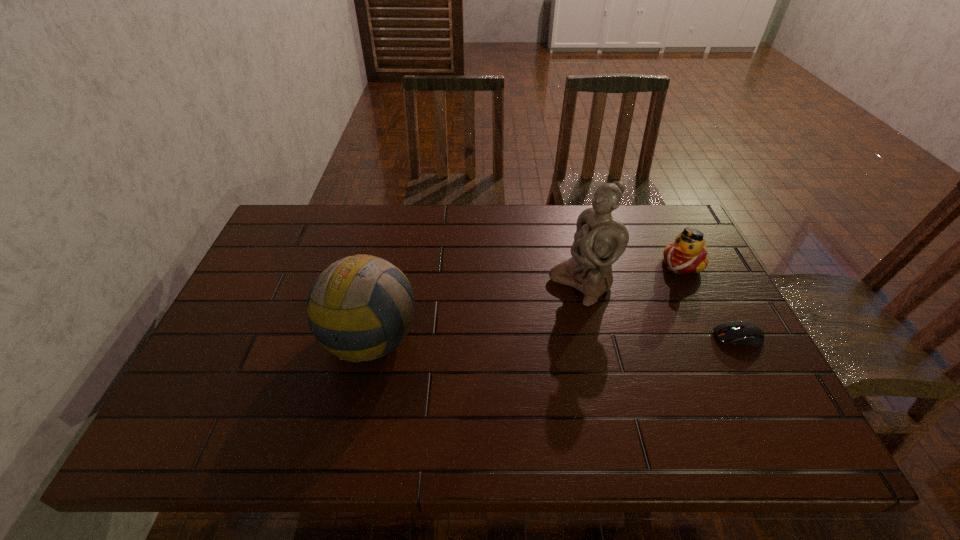
At what (x,y) coordinates should I click in order to perform the action: click on free space on the desktop that is between the second tallest object and the shortest object and is positioned on the front-facing side of the second object from left to right. Please return your answer as a coordinate pair (x, y). The height and width of the screenshot is (540, 960). Looking at the image, I should click on (500, 336).

Where is `vacant space on the desktop that is between the volleyball and the shortest object and is positioned on the face of the second shortest object`? Image resolution: width=960 pixels, height=540 pixels. vacant space on the desktop that is between the volleyball and the shortest object and is positioned on the face of the second shortest object is located at coordinates (607, 336).